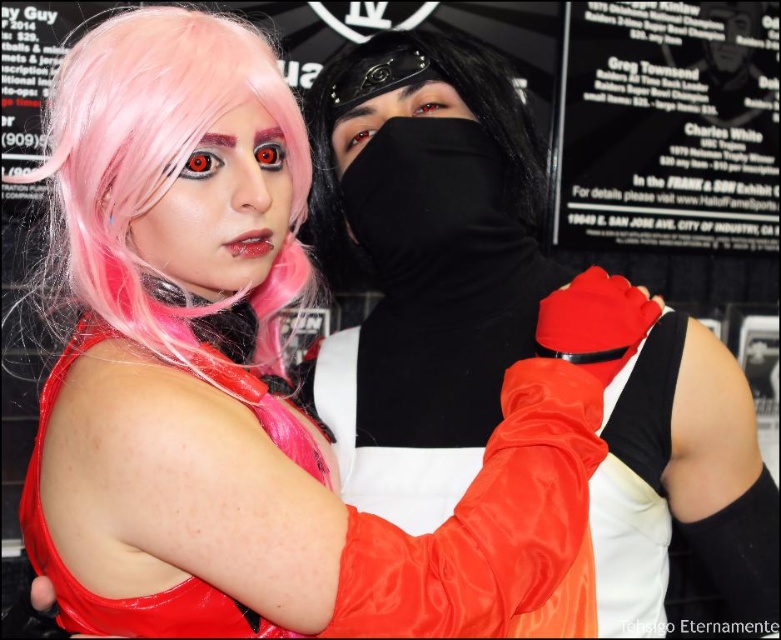
Can you confirm if matte black mask at center is positioned to the left of shiny satin gloves at upper right?

No, matte black mask at center is not to the left of shiny satin gloves at upper right.

Can you confirm if matte black mask at center is positioned above shiny satin gloves at upper right?

Yes, matte black mask at center is above shiny satin gloves at upper right.

Between point (407, 134) and point (522, 360), which one is positioned behind?

Positioned behind is point (407, 134).

You are a GUI agent. You are given a task and a screenshot of the screen. Output one action in this format:
    pyautogui.click(x=<x>, y=<y>)
    Task: Click on the matte black mask at center
    The height and width of the screenshot is (640, 781).
    Given the screenshot: What is the action you would take?
    pyautogui.click(x=421, y=262)

The height and width of the screenshot is (640, 781). Describe the element at coordinates (220, 209) in the screenshot. I see `shiny pink wig at center` at that location.

Find the location of a particular element. The height and width of the screenshot is (640, 781). shiny pink wig at center is located at coordinates (220, 209).

Which is in front, point (252, 188) or point (344, 132)?

Point (252, 188) is more forward.

Identify the location of shiny pink wig at center. (220, 209).

Can you confirm if matte black mask at center is positioned to the right of pink silky wig at upper left?

Yes, matte black mask at center is to the right of pink silky wig at upper left.

Looking at this image, does matte black mask at center appear over pink silky wig at upper left?

Incorrect, matte black mask at center is not positioned above pink silky wig at upper left.

Which is in front, point (498, 163) or point (305, 164)?

Point (305, 164) is more forward.

Where is `matte black mask at center`? Image resolution: width=781 pixels, height=640 pixels. matte black mask at center is located at coordinates (421, 262).